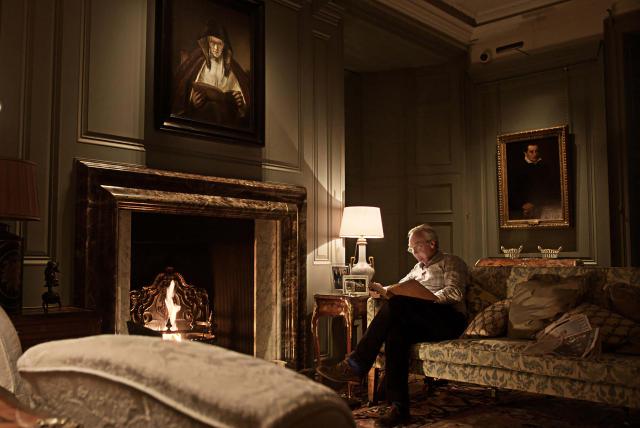
You are a GUI agent. You are given a task and a screenshot of the screen. Output one action in this format:
    pyautogui.click(x=<x>, y=<y>)
    Task: Click on the lamp
    The image size is (640, 428).
    Given the screenshot: What is the action you would take?
    pyautogui.click(x=361, y=250), pyautogui.click(x=17, y=265)